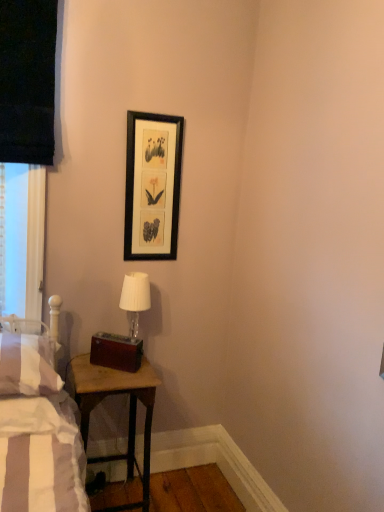
Question: Is black matte picture frame at upper center bigger than white striped pillow at left?

Choices:
 (A) no
 (B) yes

Answer: (A)

Question: Can you confirm if black matte picture frame at upper center is positioned to the right of white striped pillow at left?

Choices:
 (A) yes
 (B) no

Answer: (A)

Question: From a real-world perspective, is black matte picture frame at upper center under white striped pillow at left?

Choices:
 (A) no
 (B) yes

Answer: (A)

Question: Is black matte picture frame at upper center far away from white striped pillow at left?

Choices:
 (A) yes
 (B) no

Answer: (B)

Question: From the image's perspective, does black matte picture frame at upper center appear higher than white striped pillow at left?

Choices:
 (A) no
 (B) yes

Answer: (B)

Question: Considering the positions of black matte picture frame at upper center and white fabric lampshade at center in the image, is black matte picture frame at upper center bigger or smaller than white fabric lampshade at center?

Choices:
 (A) small
 (B) big

Answer: (A)

Question: From their relative heights in the image, would you say black matte picture frame at upper center is taller or shorter than white fabric lampshade at center?

Choices:
 (A) short
 (B) tall

Answer: (B)

Question: Relative to white fabric lampshade at center, is black matte picture frame at upper center in front or behind?

Choices:
 (A) front
 (B) behind

Answer: (B)

Question: In terms of width, does black matte picture frame at upper center look wider or thinner when compared to white fabric lampshade at center?

Choices:
 (A) wide
 (B) thin

Answer: (B)

Question: Considering their positions, is wooden table at lower left located in front of or behind black matte picture frame at upper center?

Choices:
 (A) front
 (B) behind

Answer: (A)

Question: Is wooden table at lower left spatially inside black matte picture frame at upper center, or outside of it?

Choices:
 (A) inside
 (B) outside

Answer: (B)

Question: Looking at their shapes, would you say wooden table at lower left is wider or thinner than black matte picture frame at upper center?

Choices:
 (A) wide
 (B) thin

Answer: (A)

Question: Considering the positions of point (130, 463) and point (168, 129), is point (130, 463) closer or farther from the camera than point (168, 129)?

Choices:
 (A) farther
 (B) closer

Answer: (A)

Question: In the image, is black matte picture frame at upper center positioned in front of or behind white striped pillow at left?

Choices:
 (A) behind
 (B) front

Answer: (A)

Question: From the image's perspective, is black matte picture frame at upper center above or below white striped pillow at left?

Choices:
 (A) below
 (B) above

Answer: (B)